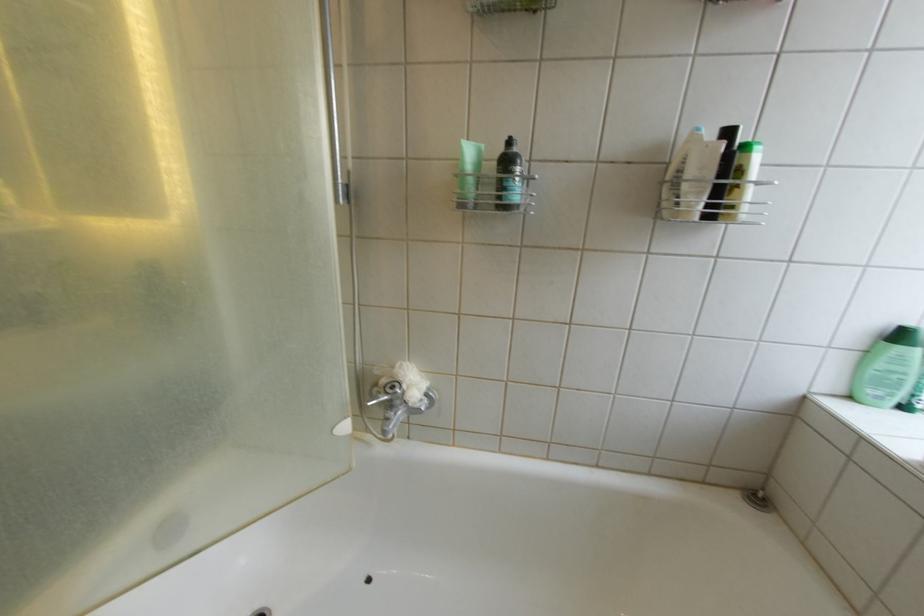
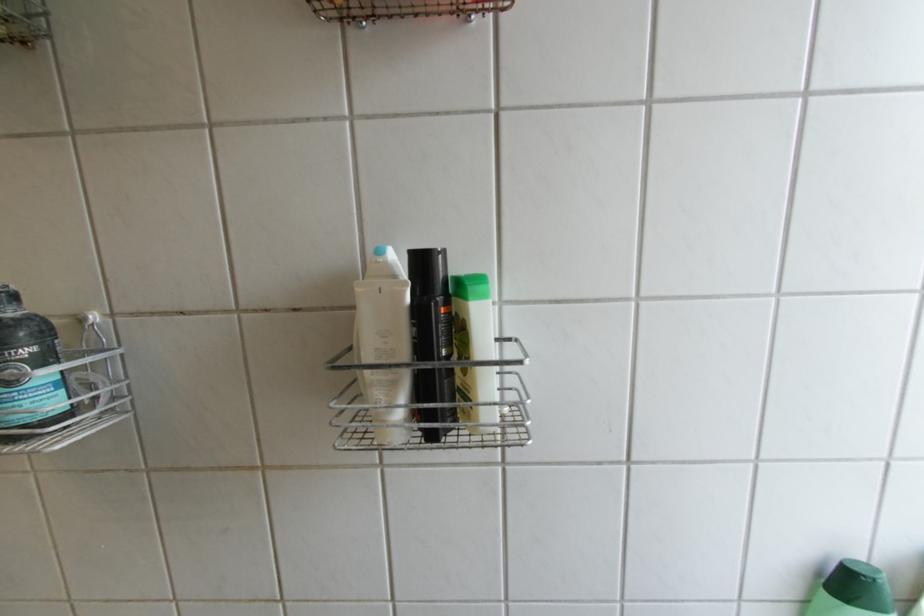
Question: The images are taken continuously from a first-person perspective. In which direction is your viewpoint rotating?

Choices:
 (A) Left
 (B) Right
 (C) Up
 (D) Down

Answer: (C)